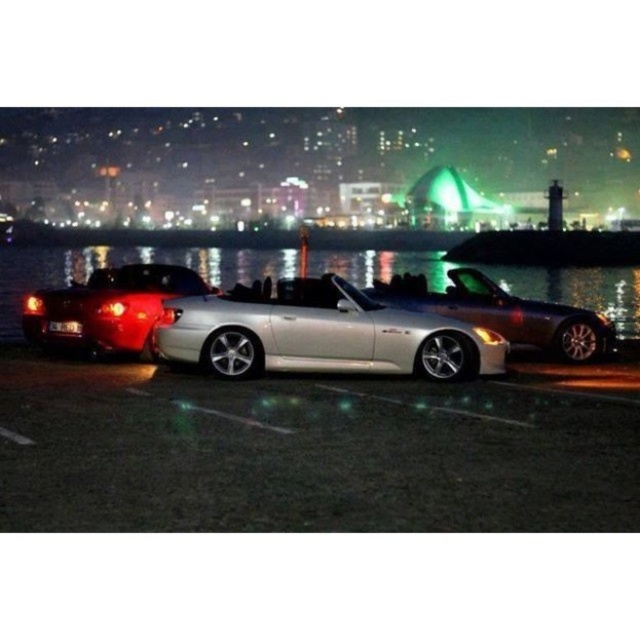
Question: Among these points, which one is farthest from the camera?

Choices:
 (A) (483, 288)
 (B) (186, 304)

Answer: (A)

Question: Is silver metallic convertible at center below shiny red convertible at left?

Choices:
 (A) yes
 (B) no

Answer: (B)

Question: Which of the following is the farthest from the observer?

Choices:
 (A) (556, 352)
 (B) (289, 250)
 (C) (346, 230)

Answer: (C)

Question: Observing the image, what is the correct spatial positioning of shiny metallic car at center in reference to shiny red convertible at left?

Choices:
 (A) right
 (B) left

Answer: (B)

Question: Can you confirm if silver metallic convertible at center is bigger than satin silver convertible at center?

Choices:
 (A) yes
 (B) no

Answer: (A)

Question: Which point is closer to the camera?

Choices:
 (A) 28,316
 (B) 54,252
 (C) 541,332

Answer: (A)